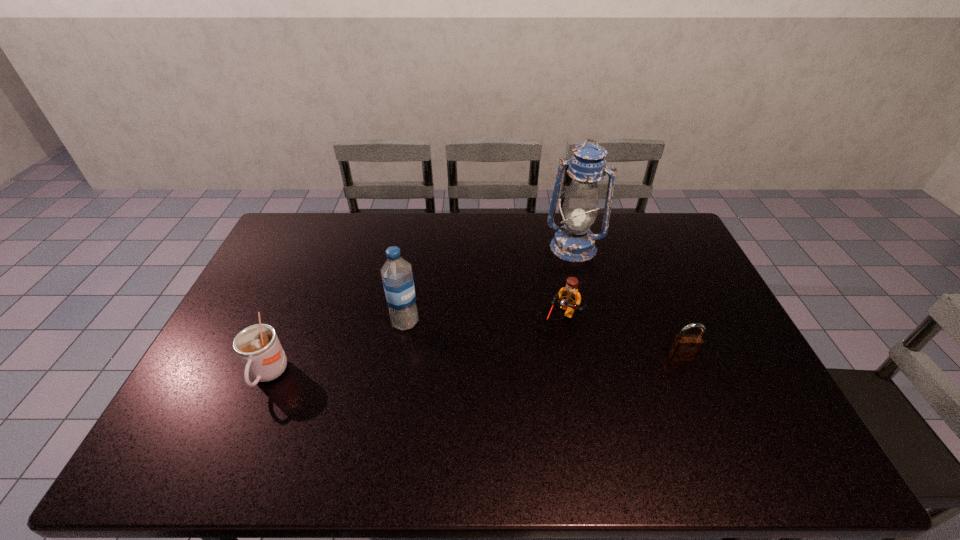
The height and width of the screenshot is (540, 960). In order to click on object that is positioned at the near edge in this screenshot , I will do `click(258, 347)`.

Identify the location of object that is positioned at the left edge. The height and width of the screenshot is (540, 960). (258, 347).

Image resolution: width=960 pixels, height=540 pixels. What are the coordinates of `object positioned at the right edge` in the screenshot? It's located at (685, 347).

Find the location of a particular element. object at the near left corner is located at coordinates (258, 347).

I want to click on vacant space at the far edge of the desktop, so click(532, 238).

Where is `vacant space at the near edge of the desktop`? This screenshot has width=960, height=540. vacant space at the near edge of the desktop is located at coordinates (476, 408).

The width and height of the screenshot is (960, 540). In the image, there is a desktop. In order to click on vacant space at the left edge in this screenshot , I will do `click(249, 389)`.

Locate an element on the screen. vacant space at the right edge of the desktop is located at coordinates (671, 282).

Identify the location of vacant region at the far left corner of the desktop. (329, 218).

The height and width of the screenshot is (540, 960). I want to click on vacant space in between the third tallest object and the second tallest object, so click(x=336, y=349).